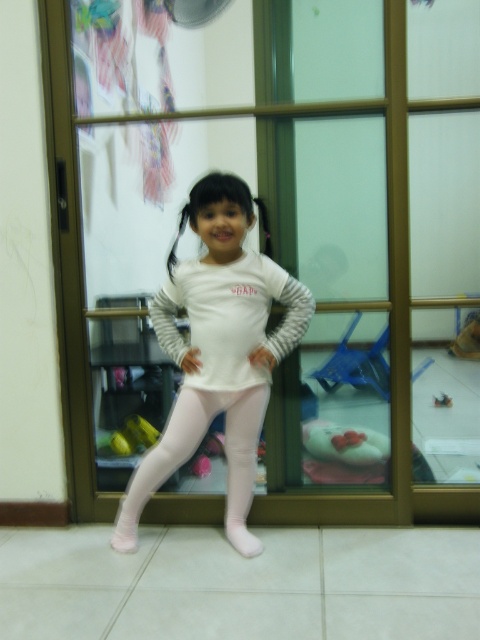
Does white matte leggings at center have a larger size compared to pink smooth leggings at center?

Yes.

Based on the photo, between white matte leggings at center and pink smooth leggings at center, which one appears on the right side from the viewer's perspective?

Positioned to the right is white matte leggings at center.

Is point (200, 368) less distant than point (254, 424)?

Yes, it is in front of point (254, 424).

Locate an element on the screen. white matte leggings at center is located at coordinates (218, 349).

From the picture: Which is above, white striped sweatshirt at center or pink smooth leggings at center?

white striped sweatshirt at center is above.

Does white striped sweatshirt at center appear on the left side of pink smooth leggings at center?

No, white striped sweatshirt at center is not to the left of pink smooth leggings at center.

Who is more distant from viewer, (x=235, y=320) or (x=169, y=440)?

The point (x=169, y=440) is behind.

Locate an element on the screen. The width and height of the screenshot is (480, 640). white striped sweatshirt at center is located at coordinates (229, 317).

Is point (224, 285) behind point (199, 326)?

No, it is not.

Does point (211, 227) lie in front of point (206, 285)?

Yes, it is in front of point (206, 285).

Locate an element on the screen. This screenshot has height=640, width=480. white matte leggings at center is located at coordinates click(x=218, y=349).